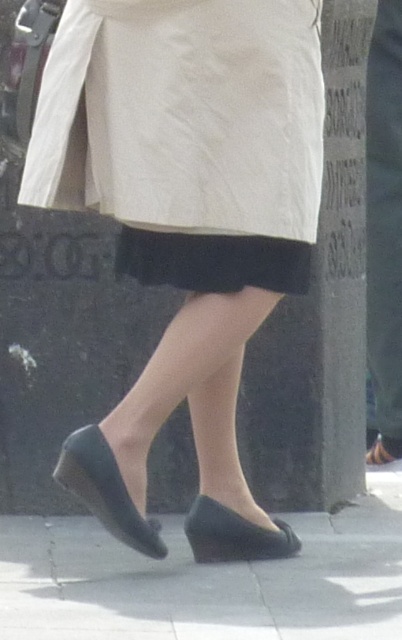
Question: Which object is positioned closest to the matte beige coat at center?

Choices:
 (A) black suede shoe at lower center
 (B) black rubber shoes at lower center
 (C) matte black shoes at center

Answer: (C)

Question: In this image, where is matte beige coat at center located relative to black matte skirt at center?

Choices:
 (A) right
 (B) left

Answer: (B)

Question: In this image, where is black matte skirt at center located relative to black suede shoe at lower center?

Choices:
 (A) left
 (B) right

Answer: (A)

Question: Based on their relative distances, which object is nearer to the matte black shoes at center?

Choices:
 (A) matte black shoe at lower left
 (B) matte beige coat at center
 (C) black suede shoe at lower center

Answer: (B)

Question: Which object appears farthest from the camera in this image?

Choices:
 (A) black matte skirt at center
 (B) matte beige coat at center
 (C) matte black shoe at lower center
 (D) black rubber shoes at lower center

Answer: (C)

Question: Is the position of black matte skirt at center more distant than that of black suede shoe at lower center?

Choices:
 (A) yes
 (B) no

Answer: (B)